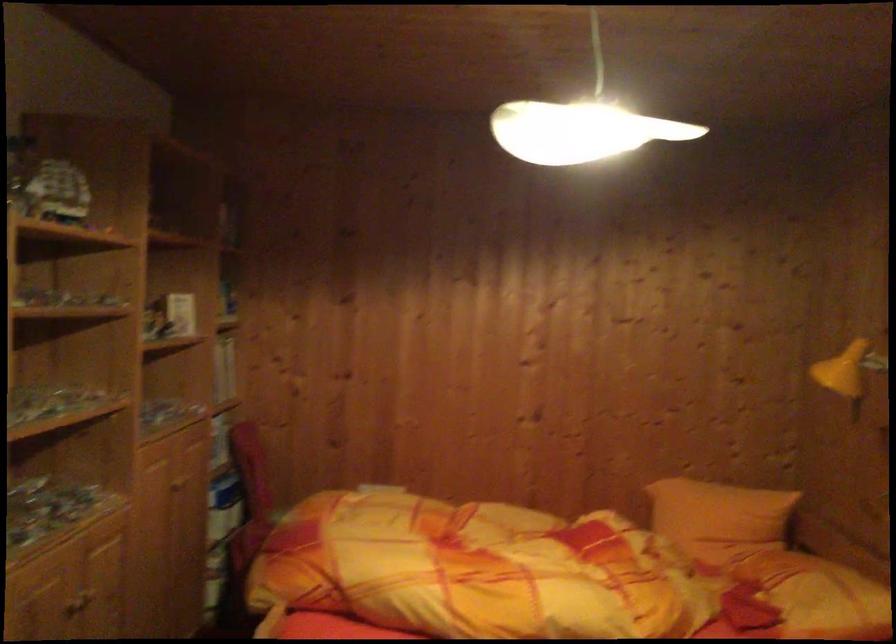
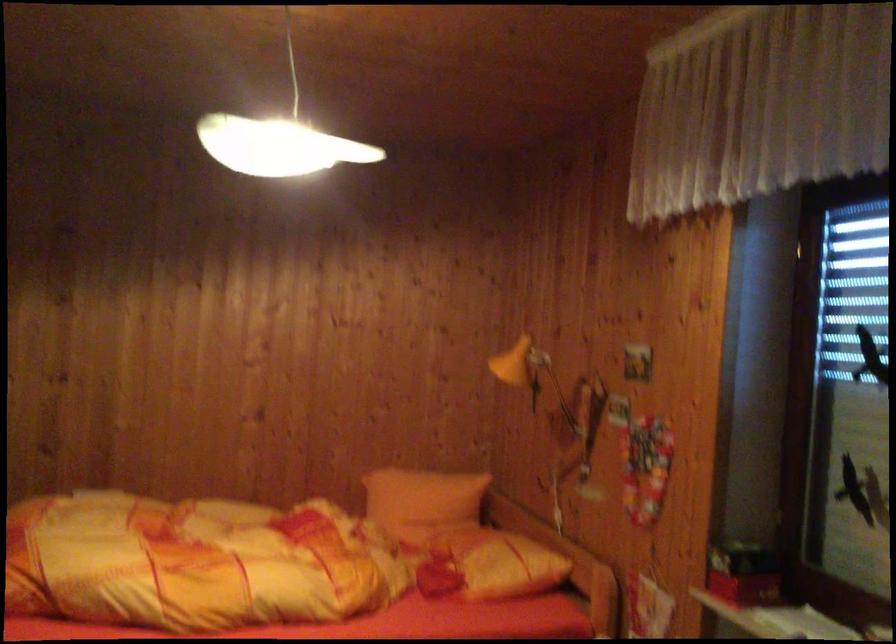
Question: Based on the continuous images, in which direction is the camera rotating? Reply with the corresponding letter.

Choices:
 (A) Left
 (B) Right
 (C) Up
 (D) Down

Answer: (B)